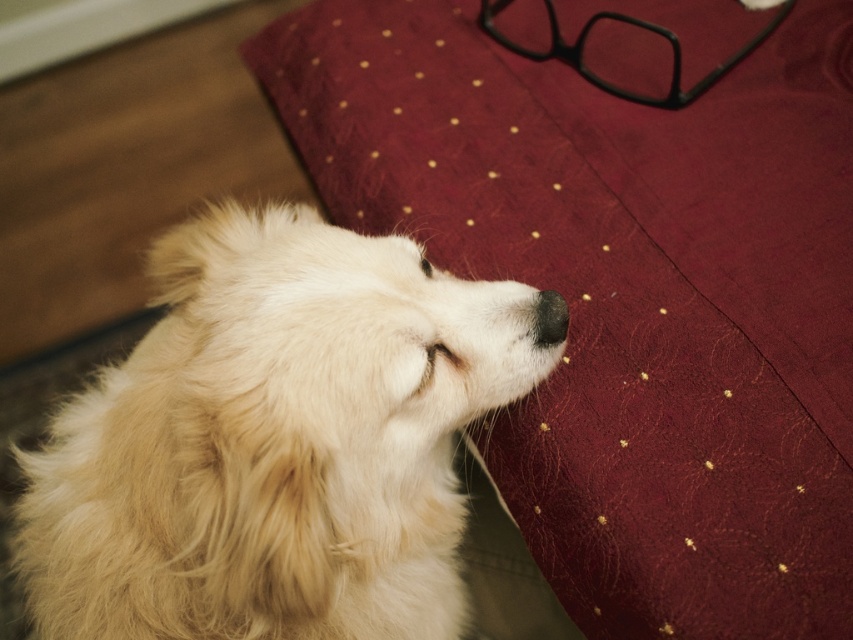
Question: Estimate the real-world distances between objects in this image. Which object is farther from the fluffy white dog at center?

Choices:
 (A) burgundy textured blanket at upper right
 (B) black matte nose at center

Answer: (A)

Question: Which point is closer to the camera?

Choices:
 (A) fluffy white dog at center
 (B) black matte nose at center
 (C) burgundy textured blanket at upper right

Answer: (A)

Question: Which point is farther to the camera?

Choices:
 (A) (550, 326)
 (B) (635, 628)

Answer: (B)

Question: Does fluffy white dog at center appear on the left side of black matte nose at center?

Choices:
 (A) yes
 (B) no

Answer: (A)

Question: Can you confirm if burgundy textured blanket at upper right is wider than fluffy white dog at center?

Choices:
 (A) yes
 (B) no

Answer: (A)

Question: Is fluffy white dog at center below black matte nose at center?

Choices:
 (A) yes
 (B) no

Answer: (A)